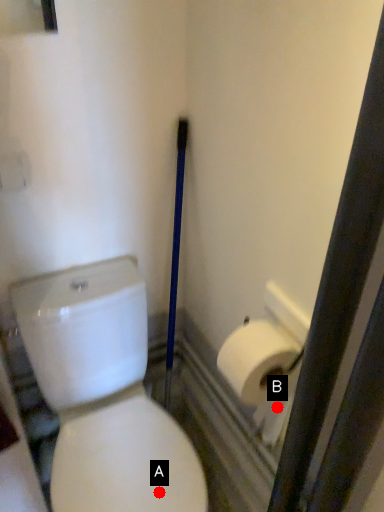
Question: Two points are circled on the image, labeled by A and B beside each circle. Which point appears closest to the camera in this image?

Choices:
 (A) A is closer
 (B) B is closer

Answer: (A)